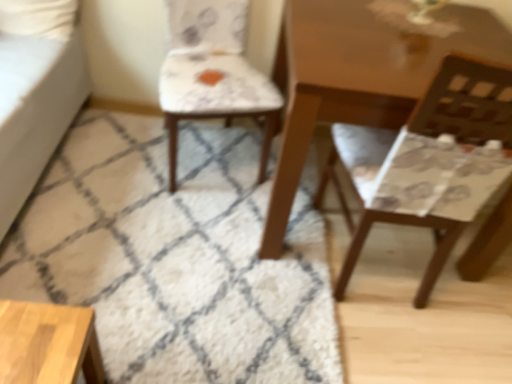
The height and width of the screenshot is (384, 512). What are the coordinates of `white shaggy rug at center` in the screenshot? It's located at (176, 256).

Measure the distance between matte brown chair at right, the 2th chair when ordered from left to right, and camera.

A distance of 36.06 inches exists between matte brown chair at right, the 2th chair when ordered from left to right, and camera.

How much space does patterned fabric chair at center, the first chair in the left-to-right sequence, occupy vertically?

33.32 inches.

This screenshot has height=384, width=512. I want to click on white shaggy rug at center, so click(x=176, y=256).

Could patterned fabric chair at center, the second chair viewed from the right, be considered to be inside white shaggy rug at center?

No.

I want to click on mat in front of the patterned fabric chair at center, the second chair viewed from the right, so click(176, 256).

Which is more to the left, white shaggy rug at center or patterned fabric chair at center, the second chair viewed from the right?

white shaggy rug at center.

From the image's perspective, which object appears higher, white shaggy rug at center or patterned fabric chair at center, the second chair viewed from the right?

From the image's view, patterned fabric chair at center, the second chair viewed from the right, is above.

Measure the distance between patterned fabric chair at center, the first chair in the left-to-right sequence, and matte brown chair at right, the 2th chair when ordered from left to right.

A distance of 24.32 inches exists between patterned fabric chair at center, the first chair in the left-to-right sequence, and matte brown chair at right, the 2th chair when ordered from left to right.

From a real-world perspective, which is physically above, patterned fabric chair at center, the second chair viewed from the right, or matte brown chair at right, marked as the 1th chair in a right-to-left arrangement?

In real-world perspective, matte brown chair at right, marked as the 1th chair in a right-to-left arrangement, is above.

From the image's perspective, is patterned fabric chair at center, the first chair in the left-to-right sequence, over matte brown chair at right, the 2th chair when ordered from left to right?

Yes, from the image's perspective, patterned fabric chair at center, the first chair in the left-to-right sequence, is above matte brown chair at right, the 2th chair when ordered from left to right.

Is patterned fabric chair at center, the first chair in the left-to-right sequence, in front of or behind matte brown chair at right, marked as the 1th chair in a right-to-left arrangement, in the image?

patterned fabric chair at center, the first chair in the left-to-right sequence, is positioned farther from the viewer than matte brown chair at right, marked as the 1th chair in a right-to-left arrangement.

Looking at this image, can you tell me how much matte brown chair at right, marked as the 1th chair in a right-to-left arrangement, and patterned fabric chair at center, the first chair in the left-to-right sequence, differ in facing direction?

There is a 165-degree angle between the facing directions of matte brown chair at right, marked as the 1th chair in a right-to-left arrangement, and patterned fabric chair at center, the first chair in the left-to-right sequence.

Which object is positioned more to the left, matte brown chair at right, marked as the 1th chair in a right-to-left arrangement, or patterned fabric chair at center, the first chair in the left-to-right sequence?

patterned fabric chair at center, the first chair in the left-to-right sequence, is more to the left.

How distant is matte brown chair at right, the 2th chair when ordered from left to right, from patterned fabric chair at center, the second chair viewed from the right?

The distance of matte brown chair at right, the 2th chair when ordered from left to right, from patterned fabric chair at center, the second chair viewed from the right, is 24.32 inches.

From a real-world perspective, is matte brown chair at right, marked as the 1th chair in a right-to-left arrangement, above or below patterned fabric chair at center, the first chair in the left-to-right sequence?

matte brown chair at right, marked as the 1th chair in a right-to-left arrangement, is situated higher than patterned fabric chair at center, the first chair in the left-to-right sequence, in the real world.

Where is `the 1st chair to the right when counting from the white shaggy rug at center`? This screenshot has height=384, width=512. the 1st chair to the right when counting from the white shaggy rug at center is located at coordinates (213, 73).

Considering the relative sizes of patterned fabric chair at center, the first chair in the left-to-right sequence, and white shaggy rug at center in the image provided, is patterned fabric chair at center, the first chair in the left-to-right sequence, shorter than white shaggy rug at center?

Incorrect, the height of patterned fabric chair at center, the first chair in the left-to-right sequence, does not fall short of that of white shaggy rug at center.

Which is in front, point (193, 44) or point (114, 321)?

The point (114, 321) is in front.

How many degrees apart are the facing directions of patterned fabric chair at center, the second chair viewed from the right, and white shaggy rug at center?

The facing directions of patterned fabric chair at center, the second chair viewed from the right, and white shaggy rug at center are 75.3 degrees apart.

Does matte brown chair at right, marked as the 1th chair in a right-to-left arrangement, appear on the right side of white shaggy rug at center?

Indeed, matte brown chair at right, marked as the 1th chair in a right-to-left arrangement, is positioned on the right side of white shaggy rug at center.

From a real-world perspective, which is physically above, matte brown chair at right, the 2th chair when ordered from left to right, or white shaggy rug at center?

In real-world perspective, matte brown chair at right, the 2th chair when ordered from left to right, is above.

Is matte brown chair at right, marked as the 1th chair in a right-to-left arrangement, not inside white shaggy rug at center?

matte brown chair at right, marked as the 1th chair in a right-to-left arrangement, lies outside white shaggy rug at center's area.

Between matte brown chair at right, marked as the 1th chair in a right-to-left arrangement, and white shaggy rug at center, which one has less height?

Standing shorter between the two is white shaggy rug at center.

Between point (211, 135) and point (474, 132), which one is positioned in front?

The point (474, 132) is closer.

Consider the image. Is white shaggy rug at center in contact with matte brown chair at right, marked as the 1th chair in a right-to-left arrangement?

They are not placed beside each other.

Considering the relative positions of white shaggy rug at center and matte brown chair at right, the 2th chair when ordered from left to right, in the image provided, is white shaggy rug at center to the left of matte brown chair at right, the 2th chair when ordered from left to right, from the viewer's perspective?

Yes, white shaggy rug at center is to the left of matte brown chair at right, the 2th chair when ordered from left to right.

This screenshot has height=384, width=512. What are the coordinates of `chair that is the 1st object to the right of the white shaggy rug at center, starting at the anchor` in the screenshot? It's located at (213, 73).

In the image, there is a matte brown chair at right, marked as the 1th chair in a right-to-left arrangement. Find the location of `chair above it (from the image's perspective)`. chair above it (from the image's perspective) is located at coordinates click(x=213, y=73).

Which object lies further to the anchor point matte brown chair at right, marked as the 1th chair in a right-to-left arrangement, patterned fabric chair at center, the first chair in the left-to-right sequence, or white shaggy rug at center?

white shaggy rug at center.

When comparing their distances from matte brown chair at right, the 2th chair when ordered from left to right, does white shaggy rug at center or patterned fabric chair at center, the second chair viewed from the right, seem closer?

patterned fabric chair at center, the second chair viewed from the right, is positioned closer to the anchor matte brown chair at right, the 2th chair when ordered from left to right.

Considering their positions, is matte brown chair at right, marked as the 1th chair in a right-to-left arrangement, positioned closer to white shaggy rug at center than patterned fabric chair at center, the first chair in the left-to-right sequence?

Based on the image, patterned fabric chair at center, the first chair in the left-to-right sequence, appears to be nearer to white shaggy rug at center.

Looking at the image, which one is located closer to white shaggy rug at center, patterned fabric chair at center, the second chair viewed from the right, or matte brown chair at right, marked as the 1th chair in a right-to-left arrangement?

patterned fabric chair at center, the second chair viewed from the right.

Estimate the real-world distances between objects in this image. Which object is further from patterned fabric chair at center, the second chair viewed from the right, white shaggy rug at center or matte brown chair at right, marked as the 1th chair in a right-to-left arrangement?

The object further to patterned fabric chair at center, the second chair viewed from the right, is matte brown chair at right, marked as the 1th chair in a right-to-left arrangement.

Consider the image. Based on their spatial positions, is matte brown chair at right, marked as the 1th chair in a right-to-left arrangement, or white shaggy rug at center further from patterned fabric chair at center, the first chair in the left-to-right sequence?

The object further to patterned fabric chair at center, the first chair in the left-to-right sequence, is matte brown chair at right, marked as the 1th chair in a right-to-left arrangement.

Image resolution: width=512 pixels, height=384 pixels. What are the coordinates of `chair between white shaggy rug at center and matte brown chair at right, marked as the 1th chair in a right-to-left arrangement, from left to right` in the screenshot? It's located at [x=213, y=73].